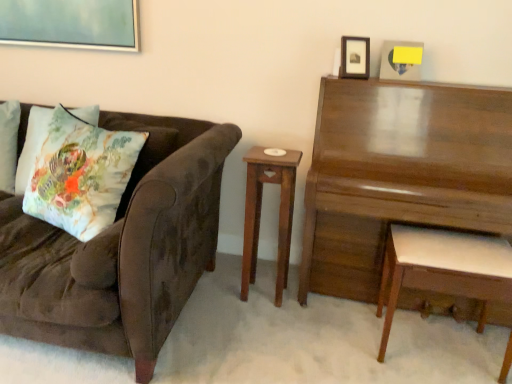
At what (x,y) coordinates should I click in order to perform the action: click on vacant position to the left of wooden nightstand at center. Please return your answer as a coordinate pair (x, y). Image resolution: width=512 pixels, height=384 pixels. Looking at the image, I should click on (217, 293).